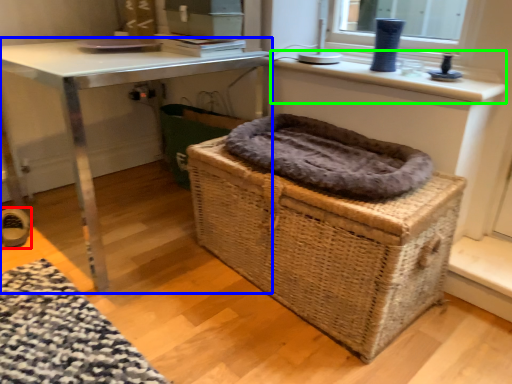
Question: Which is nearer to the shoe (highlighted by a red box)? table (highlighted by a blue box) or counter top (highlighted by a green box).

Choices:
 (A) table
 (B) counter top

Answer: (A)